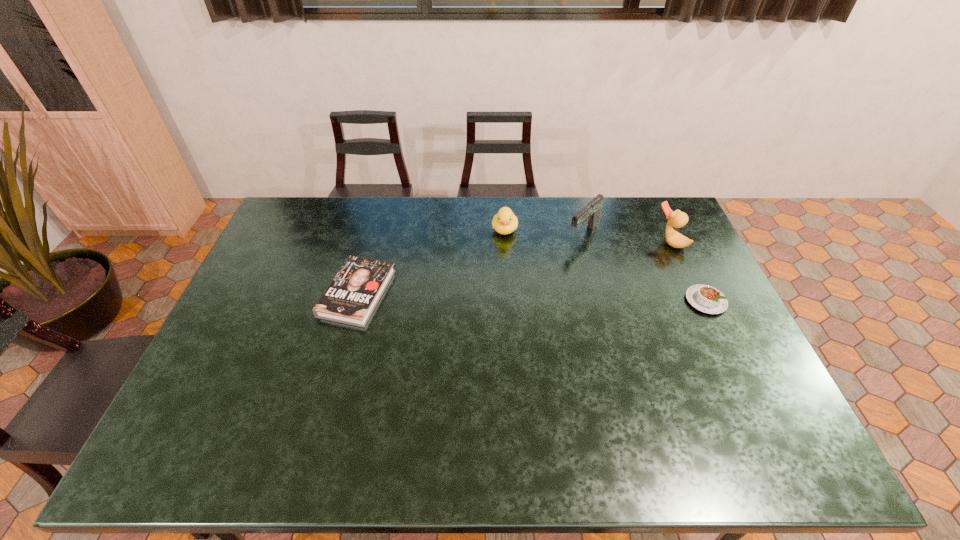
Where is `free spot on the desktop that is between the book and the second shortest object and is positioned on the beak of the duck`? free spot on the desktop that is between the book and the second shortest object and is positioned on the beak of the duck is located at coordinates (574, 298).

Find the location of a particular element. The height and width of the screenshot is (540, 960). vacant spot on the desktop that is between the leftmost object and the pudding and is positioned aim along the barrel of the third object from right to left is located at coordinates (516, 296).

This screenshot has width=960, height=540. Find the location of `vacant space on the desktop that is between the book and the second shortest object and is positioned on the beak of the second object from left to right`. vacant space on the desktop that is between the book and the second shortest object and is positioned on the beak of the second object from left to right is located at coordinates (497, 296).